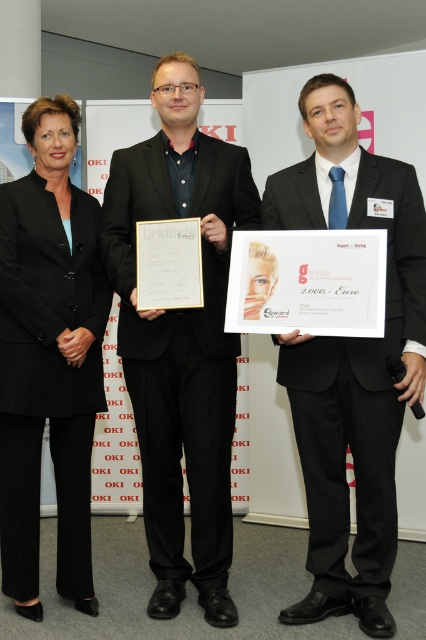
Question: Which object is positioned farthest from the black matte suit at center?

Choices:
 (A) black glossy suit at center
 (B) black suit at left

Answer: (A)

Question: Observing the image, what is the correct spatial positioning of black matte suit at center in reference to black suit at left?

Choices:
 (A) right
 (B) left

Answer: (A)

Question: Is black matte suit at center to the right of black suit at left from the viewer's perspective?

Choices:
 (A) yes
 (B) no

Answer: (A)

Question: Among these objects, which one is nearest to the camera?

Choices:
 (A) black matte suit at center
 (B) black glossy suit at center

Answer: (B)

Question: Does black matte suit at center have a greater width compared to black suit at left?

Choices:
 (A) no
 (B) yes

Answer: (B)

Question: Among these points, which one is nearest to the camera?

Choices:
 (A) (74, 493)
 (B) (388, 204)

Answer: (B)